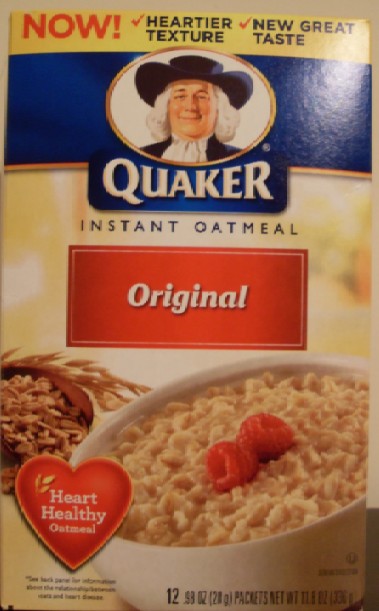
This screenshot has height=611, width=379. I want to click on white background wall, so click(4, 2).